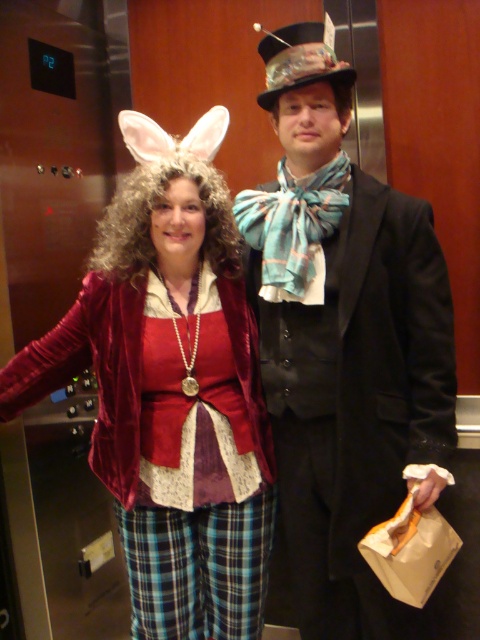
Is the position of shiny black suit at center less distant than that of velvet red jacket at center?

Yes, it is.

Does shiny black suit at center come behind velvet red jacket at center?

No, shiny black suit at center is in front of velvet red jacket at center.

Does point (343, 544) lie behind point (200, 570)?

No, (343, 544) is closer to viewer.

Locate an element on the screen. The image size is (480, 640). shiny black suit at center is located at coordinates [x=343, y=340].